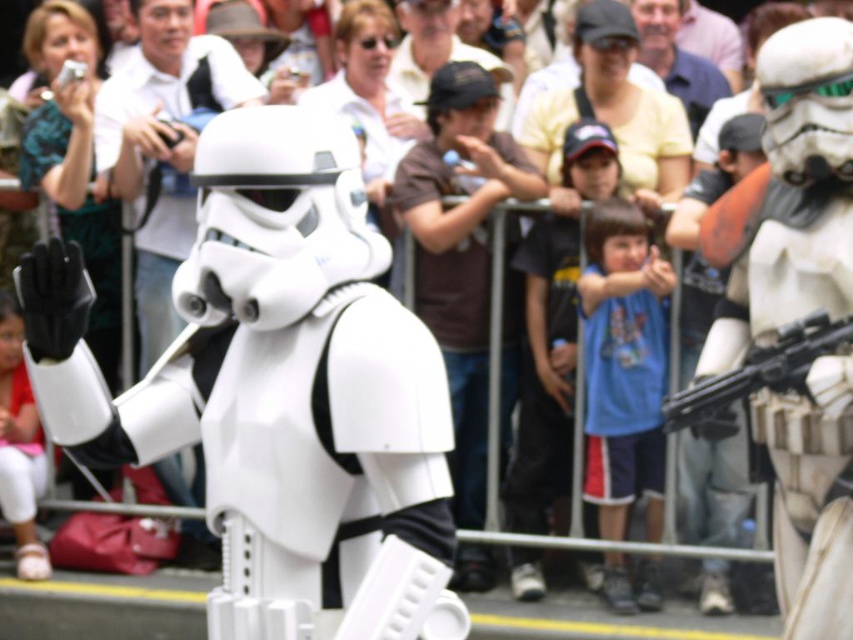
Does blue cotton shirt at center have a lesser height compared to matte black gun at right?

In fact, blue cotton shirt at center may be taller than matte black gun at right.

Which is behind, point (630, 438) or point (735, 371)?

The point (630, 438) is more distant.

Locate an element on the screen. The height and width of the screenshot is (640, 853). blue cotton shirt at center is located at coordinates (622, 364).

Can you confirm if white matte helmet at center is taller than matte black gun at right?

Yes, white matte helmet at center is taller than matte black gun at right.

Who is more distant from viewer, [235,64] or [799,356]?

The point [235,64] is more distant.

Is point (173, 472) less distant than point (772, 387)?

No.

Find the location of a particular element. The width and height of the screenshot is (853, 640). white matte helmet at center is located at coordinates (164, 145).

Does brown cotton t-shirt at center come in front of blue cotton shirt at center?

No.

This screenshot has width=853, height=640. Find the location of `brown cotton t-shirt at center`. brown cotton t-shirt at center is located at coordinates (460, 250).